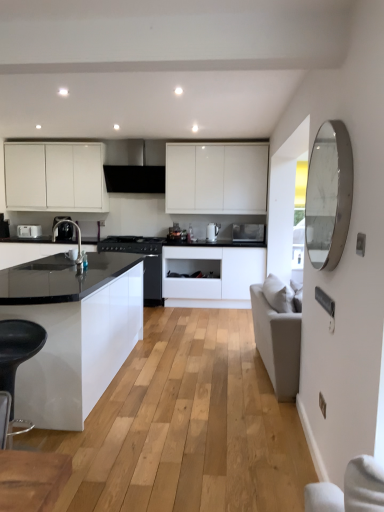
This screenshot has height=512, width=384. In order to click on black glossy stove at center in this screenshot , I will do `click(144, 261)`.

Locate an element on the screen. The image size is (384, 512). silver/metallic mirror at right is located at coordinates (329, 195).

What is the approximate height of matte black sink at center?

matte black sink at center is 16.32 inches tall.

Locate an element on the screen. Image resolution: width=384 pixels, height=512 pixels. black glossy stove at center is located at coordinates (144, 261).

Does point (160, 245) lie in front of point (65, 226)?

No, (160, 245) is behind (65, 226).

Is satin black coffee machine at left at the back of black matte stove at center, the first appliance positioned from the left?

black matte stove at center, the first appliance positioned from the left, is not turned away from satin black coffee machine at left.

Which is correct: black matte stove at center, arranged as the 3th appliance when viewed from the right, is inside satin black coffee machine at left, or outside of it?

black matte stove at center, arranged as the 3th appliance when viewed from the right, is outside satin black coffee machine at left.

Is black matte stove at center, the first appliance positioned from the left, next to satin black coffee machine at left and touching it?

No, black matte stove at center, the first appliance positioned from the left, is not making contact with satin black coffee machine at left.

Is black matte stove at center, the first appliance positioned from the left, not within matte white toaster at left, which is the 1th kitchen appliance from back to front?

That's correct, black matte stove at center, the first appliance positioned from the left, is outside of matte white toaster at left, which is the 1th kitchen appliance from back to front.

Which is nearer, (102, 241) or (40, 228)?

Clearly, point (102, 241) is closer to the camera than point (40, 228).

Looking at this image, can you tell me how much black matte stove at center, the first appliance positioned from the left, and matte white toaster at left, the 2th kitchen appliance viewed from the front, differ in facing direction?

They differ by 1.14 degrees in their facing directions.

Image resolution: width=384 pixels, height=512 pixels. Find the location of `appliance that is under the matte white toaster at left, acting as the first kitchen appliance starting from the left (from a real-world perspective)`. appliance that is under the matte white toaster at left, acting as the first kitchen appliance starting from the left (from a real-world perspective) is located at coordinates (131, 244).

Could you tell me if matte white toaster at left, which is counted as the second kitchen appliance, starting from the right, is turned towards white glossy kettle at center, the second appliance viewed from the left?

No, matte white toaster at left, which is counted as the second kitchen appliance, starting from the right, is not oriented towards white glossy kettle at center, the second appliance viewed from the left.

Which object is further away from the camera, matte white toaster at left, which is counted as the second kitchen appliance, starting from the right, or white glossy kettle at center, the second appliance viewed from the left?

white glossy kettle at center, the second appliance viewed from the left.

Between matte white toaster at left, acting as the first kitchen appliance starting from the left, and white glossy kettle at center, the second appliance viewed from the left, which one has larger width?

With larger width is matte white toaster at left, acting as the first kitchen appliance starting from the left.

Where is `kitchen appliance on the left of white glossy kettle at center, the 2th appliance in the right-to-left sequence`? Image resolution: width=384 pixels, height=512 pixels. kitchen appliance on the left of white glossy kettle at center, the 2th appliance in the right-to-left sequence is located at coordinates (29, 231).

Is the depth of black plastic bar stool at lower left less than that of matte black sink at center?

Yes, black plastic bar stool at lower left is closer to the viewer.

Considering the relative positions of black plastic bar stool at lower left and matte black sink at center in the image provided, is black plastic bar stool at lower left to the left of matte black sink at center from the viewer's perspective?

In fact, black plastic bar stool at lower left is to the right of matte black sink at center.

From the image's perspective, would you say black plastic bar stool at lower left is shown under matte black sink at center?

Yes, from the image's perspective, black plastic bar stool at lower left is beneath matte black sink at center.

Can you confirm if white matte cabinet at upper left, the 1th cabinetry viewed from the top, is smaller than silver/metallic mirror at right?

Incorrect, white matte cabinet at upper left, the 1th cabinetry viewed from the top, is not smaller in size than silver/metallic mirror at right.

From a real-world perspective, which is physically above, white matte cabinet at upper left, placed as the second cabinetry when sorted from bottom to top, or silver/metallic mirror at right?

From a 3D spatial view, white matte cabinet at upper left, placed as the second cabinetry when sorted from bottom to top, is above.

Considering the sizes of objects white matte cabinet at upper left, marked as the 2th cabinetry in a right-to-left arrangement, and silver/metallic mirror at right in the image provided, who is taller, white matte cabinet at upper left, marked as the 2th cabinetry in a right-to-left arrangement, or silver/metallic mirror at right?

Standing taller between the two is white matte cabinet at upper left, marked as the 2th cabinetry in a right-to-left arrangement.

Can you tell me how much white matte cabinet at upper left, the 1th cabinetry viewed from the top, and black plastic bar stool at lower left differ in facing direction?

white matte cabinet at upper left, the 1th cabinetry viewed from the top, and black plastic bar stool at lower left are facing 24.9 degrees away from each other.

Is white matte cabinet at upper left, which appears as the 1th cabinetry when viewed from the left, far away from black plastic bar stool at lower left?

Indeed, white matte cabinet at upper left, which appears as the 1th cabinetry when viewed from the left, is not near black plastic bar stool at lower left.

Considering the sizes of objects white matte cabinet at upper left, the 1th cabinetry viewed from the top, and black plastic bar stool at lower left in the image provided, who is smaller, white matte cabinet at upper left, the 1th cabinetry viewed from the top, or black plastic bar stool at lower left?

black plastic bar stool at lower left.

Which object is positioned more to the right, white matte cabinet at upper left, which appears as the 1th cabinetry when viewed from the left, or black plastic bar stool at lower left?

Positioned to the right is black plastic bar stool at lower left.

From a real-world perspective, relative to silver/metallic mirror at right, is metallic silver microwave at center, the 3th appliance when ordered from left to right, vertically above or below?

metallic silver microwave at center, the 3th appliance when ordered from left to right, is situated lower than silver/metallic mirror at right in the real world.

Choose the correct answer: Is metallic silver microwave at center, the 3th appliance when ordered from left to right, inside silver/metallic mirror at right or outside it?

metallic silver microwave at center, the 3th appliance when ordered from left to right, is located beyond the bounds of silver/metallic mirror at right.

In terms of width, does metallic silver microwave at center, the 3th appliance when ordered from left to right, look wider or thinner when compared to silver/metallic mirror at right?

Clearly, metallic silver microwave at center, the 3th appliance when ordered from left to right, has more width compared to silver/metallic mirror at right.

Is metallic silver microwave at center, the 3th appliance when ordered from left to right, in contact with silver/metallic mirror at right?

There is a gap between metallic silver microwave at center, the 3th appliance when ordered from left to right, and silver/metallic mirror at right.

The image size is (384, 512). Find the location of `appliance that is the 3rd one when counting downward from the satin black coffee machine at left (from the image's perspective)`. appliance that is the 3rd one when counting downward from the satin black coffee machine at left (from the image's perspective) is located at coordinates (131, 244).

Find the location of `kitchen appliance on the left of black matte stove at center, the first appliance positioned from the left`. kitchen appliance on the left of black matte stove at center, the first appliance positioned from the left is located at coordinates (29, 231).

From the image, which object appears to be farther from white matte cabinet at center, which is counted as the first cabinetry, starting from the right, black matte stove at center, arranged as the 3th appliance when viewed from the right, or white glossy kettle at center, which appears as the 2th kitchen appliance when viewed from the left?

Based on the image, black matte stove at center, arranged as the 3th appliance when viewed from the right, appears to be further to white matte cabinet at center, which is counted as the first cabinetry, starting from the right.

When comparing their distances from white matte cabinet at center, arranged as the first cabinetry when ordered from the bottom, does satin black coffee machine at left or white glossy kettle at center, which appears as the 2th kitchen appliance when viewed from the left, seem further?

Among the two, satin black coffee machine at left is located further to white matte cabinet at center, arranged as the first cabinetry when ordered from the bottom.

From the image, which object appears to be farther from white matte cabinet at center, which ranks as the second cabinetry in left-to-right order, metallic silver microwave at center, which is counted as the first appliance, starting from the right, or black plastic bar stool at lower left?

black plastic bar stool at lower left.

Looking at this image, when comparing their distances from matte white toaster at left, which is counted as the second kitchen appliance, starting from the right, does matte black sink at center or silver/metallic mirror at right seem closer?

Based on the image, matte black sink at center appears to be nearer to matte white toaster at left, which is counted as the second kitchen appliance, starting from the right.

Estimate the real-world distances between objects in this image. Which object is further from metallic silver microwave at center, which is counted as the first appliance, starting from the right, white glossy kettle at center, the first kitchen appliance viewed from the right, or silver/metallic mirror at right?

silver/metallic mirror at right lies further to metallic silver microwave at center, which is counted as the first appliance, starting from the right, than the other object.

Looking at the image, which one is located further to white glossy kettle at center, the first kitchen appliance viewed from the right, white glossy kettle at center, the second appliance viewed from the left, or matte black sink at center?

matte black sink at center is further to white glossy kettle at center, the first kitchen appliance viewed from the right.

Estimate the real-world distances between objects in this image. Which object is closer to white glossy kettle at center, the 2th appliance in the right-to-left sequence, black matte exhaust hood at upper center or matte white toaster at left, which is counted as the second kitchen appliance, starting from the right?

black matte exhaust hood at upper center is closer to white glossy kettle at center, the 2th appliance in the right-to-left sequence.

Which object lies further to the anchor point black matte exhaust hood at upper center, black glossy stove at center or matte black sink at center?

matte black sink at center is positioned further to the anchor black matte exhaust hood at upper center.

This screenshot has height=512, width=384. Find the location of `exhaust hood between white matte cabinet at upper left, the 1th cabinetry viewed from the top, and metallic silver microwave at center, the 3th appliance when ordered from left to right, from left to right`. exhaust hood between white matte cabinet at upper left, the 1th cabinetry viewed from the top, and metallic silver microwave at center, the 3th appliance when ordered from left to right, from left to right is located at coordinates coord(134,167).

Where is `cabinetry located between matte white toaster at left, which is counted as the second kitchen appliance, starting from the right, and black glossy stove at center in the left-right direction`? cabinetry located between matte white toaster at left, which is counted as the second kitchen appliance, starting from the right, and black glossy stove at center in the left-right direction is located at coordinates (55, 177).

This screenshot has height=512, width=384. What are the coordinates of `exhaust hood between black matte stove at center, the first appliance positioned from the left, and metallic silver microwave at center, the 3th appliance when ordered from left to right, in the horizontal direction` in the screenshot? It's located at (134, 167).

Image resolution: width=384 pixels, height=512 pixels. Find the location of `sink between black plastic bar stool at lower left and white matte cabinet at center, which is counted as the first cabinetry, starting from the right, in the front-back direction`. sink between black plastic bar stool at lower left and white matte cabinet at center, which is counted as the first cabinetry, starting from the right, in the front-back direction is located at coordinates (78, 237).